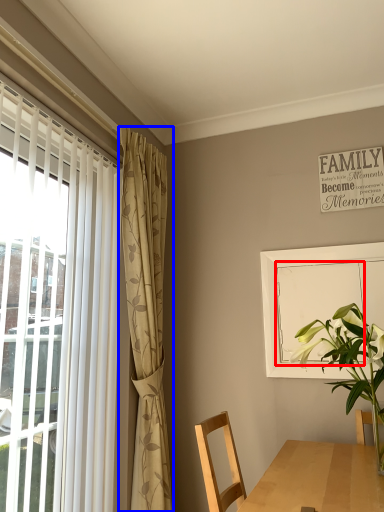
Question: Which object is closer to the camera taking this photo, screen door (highlighted by a red box) or curtain (highlighted by a blue box)?

Choices:
 (A) screen door
 (B) curtain

Answer: (B)